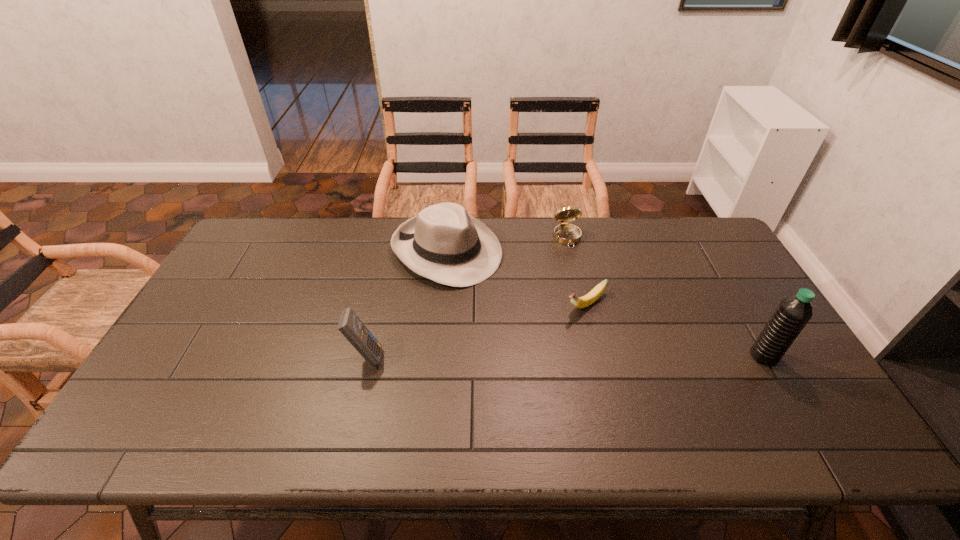
I want to click on free space located 0.070m at the stem of the third nearest object, so click(x=553, y=326).

I want to click on vacant space situated 0.150m at the stem of the third nearest object, so (x=533, y=340).

I want to click on vacant space located 0.190m on the front-facing side of the fedora, so click(534, 308).

The height and width of the screenshot is (540, 960). In order to click on blank area located on the front-facing side of the fedora in this screenshot , I will do `click(547, 317)`.

You are a GUI agent. You are given a task and a screenshot of the screen. Output one action in this format:
    pyautogui.click(x=<x>, y=<y>)
    Task: Click on the vacant space positioned 0.190m on the front-facing side of the fedora
    The height and width of the screenshot is (540, 960).
    Given the screenshot: What is the action you would take?
    pyautogui.click(x=534, y=308)

At what (x,y) coordinates should I click in order to perform the action: click on vacant region located 0.150m with the dial facing the fourth tallest object. Please return your answer as a coordinate pair (x, y). Looking at the image, I should click on (582, 279).

Identify the location of vacant point located 0.160m with the dial facing the fourth tallest object. The image size is (960, 540). (583, 281).

I want to click on vacant space positioned 0.340m with the dial facing the fourth tallest object, so click(x=599, y=325).

The width and height of the screenshot is (960, 540). Find the location of `fedora that is positioned at the far edge`. fedora that is positioned at the far edge is located at coordinates (443, 243).

This screenshot has height=540, width=960. Find the location of `compass located at the far edge`. compass located at the far edge is located at coordinates (565, 233).